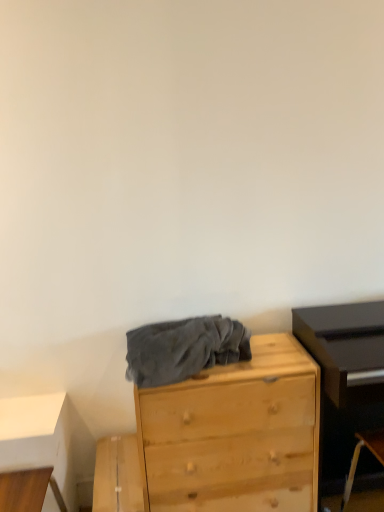
Question: Looking at their shapes, would you say light wood chest of drawers at center is wider or thinner than wooden table at lower left?

Choices:
 (A) wide
 (B) thin

Answer: (A)

Question: Considering the positions of point (147, 497) and point (4, 401), is point (147, 497) closer or farther from the camera than point (4, 401)?

Choices:
 (A) closer
 (B) farther

Answer: (A)

Question: Estimate the real-world distances between objects in this image. Which object is closer to the gray fleece blanket at center?

Choices:
 (A) wooden table at lower left
 (B) light wood chest of drawers at center

Answer: (B)

Question: Considering the real-world distances, which object is farthest from the gray fleece blanket at center?

Choices:
 (A) wooden table at lower left
 (B) light wood chest of drawers at center

Answer: (A)